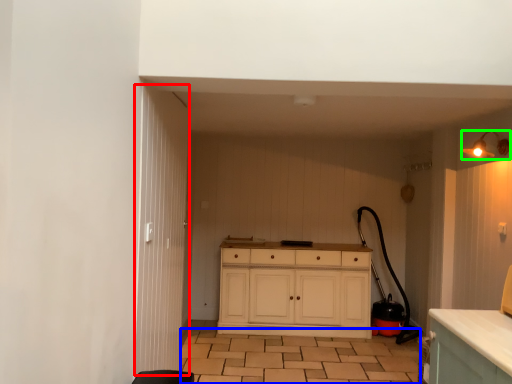
Question: Based on their relative distances, which object is nearer to door (highlighted by a red box)? Choose from tile (highlighted by a blue box) and light fixture (highlighted by a green box).

Choices:
 (A) tile
 (B) light fixture

Answer: (A)